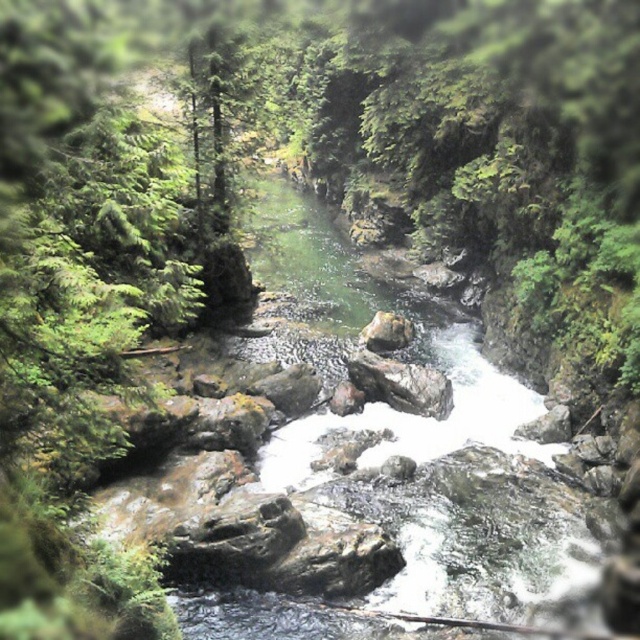
Does rough textured rock at center appear on the left side of smooth gray rock at center?

Indeed, rough textured rock at center is positioned on the left side of smooth gray rock at center.

In the scene shown: Between rough textured rock at center and smooth gray rock at center, which one appears on the right side from the viewer's perspective?

Positioned to the right is smooth gray rock at center.

This screenshot has height=640, width=640. What do you see at coordinates (401, 384) in the screenshot? I see `rough textured rock at center` at bounding box center [401, 384].

Image resolution: width=640 pixels, height=640 pixels. Identify the location of rough textured rock at center. (401, 384).